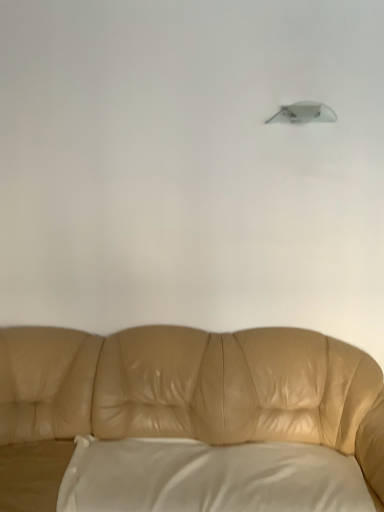
You are a GUI agent. You are given a task and a screenshot of the screen. Output one action in this format:
    pyautogui.click(x=<x>, y=<y>)
    Task: Click on the satin gray lampshade at upper center
    
    Given the screenshot: What is the action you would take?
    pyautogui.click(x=303, y=113)

The image size is (384, 512). What do you see at coordinates (210, 477) in the screenshot? I see `white satin pillow at lower center` at bounding box center [210, 477].

The image size is (384, 512). What are the coordinates of `satin gray lampshade at upper center` in the screenshot? It's located at click(303, 113).

Is white satin pillow at lower center situated inside tan leather couch at center or outside?

white satin pillow at lower center is contained in tan leather couch at center.

Between white satin pillow at lower center and tan leather couch at center, which one appears on the left side from the viewer's perspective?

tan leather couch at center.

Is the position of white satin pillow at lower center more distant than that of tan leather couch at center?

Yes, it is behind tan leather couch at center.

Does white satin pillow at lower center have a lesser width compared to satin gray lampshade at upper center?

No, white satin pillow at lower center is not thinner than satin gray lampshade at upper center.

Considering the relative sizes of white satin pillow at lower center and satin gray lampshade at upper center in the image provided, is white satin pillow at lower center smaller than satin gray lampshade at upper center?

Incorrect, white satin pillow at lower center is not smaller in size than satin gray lampshade at upper center.

Considering the sizes of white satin pillow at lower center and satin gray lampshade at upper center in the image, is white satin pillow at lower center taller or shorter than satin gray lampshade at upper center?

In the image, white satin pillow at lower center appears to be taller than satin gray lampshade at upper center.

From a real-world perspective, is white satin pillow at lower center physically below satin gray lampshade at upper center?

Yes, from a real-world perspective, white satin pillow at lower center is under satin gray lampshade at upper center.

Between tan leather couch at center and satin gray lampshade at upper center, which one has less height?

Standing shorter between the two is satin gray lampshade at upper center.

From a real-world perspective, is tan leather couch at center located higher than satin gray lampshade at upper center?

No, from a real-world perspective, tan leather couch at center is not on top of satin gray lampshade at upper center.

From the image's perspective, which is below, tan leather couch at center or satin gray lampshade at upper center?

tan leather couch at center appears lower in the image.

Which object is positioned more to the left, tan leather couch at center or white satin pillow at lower center?

tan leather couch at center.

From a real-world perspective, is tan leather couch at center positioned under white satin pillow at lower center based on gravity?

Actually, tan leather couch at center is physically above white satin pillow at lower center in the real world.

Are tan leather couch at center and white satin pillow at lower center making contact?

tan leather couch at center is not next to white satin pillow at lower center, and they're not touching.

Would you say white satin pillow at lower center is part of tan leather couch at center's contents?

Yes.

Where is `pillow located underneath the satin gray lampshade at upper center (from a real-world perspective)`? pillow located underneath the satin gray lampshade at upper center (from a real-world perspective) is located at coordinates click(x=210, y=477).

Is satin gray lampshade at upper center taller than white satin pillow at lower center?

In fact, satin gray lampshade at upper center may be shorter than white satin pillow at lower center.

Which object is closer to the camera, satin gray lampshade at upper center or white satin pillow at lower center?

white satin pillow at lower center.

Does satin gray lampshade at upper center touch white satin pillow at lower center?

No, satin gray lampshade at upper center is not beside white satin pillow at lower center.

From the picture: Can you tell me how much satin gray lampshade at upper center and tan leather couch at center differ in facing direction?

There is a 0.208-degree angle between the facing directions of satin gray lampshade at upper center and tan leather couch at center.

Which of these two, satin gray lampshade at upper center or tan leather couch at center, is smaller?

satin gray lampshade at upper center is smaller.

Which point is more distant from viewer, (331, 116) or (359, 454)?

Positioned behind is point (331, 116).

Which object is thinner, satin gray lampshade at upper center or tan leather couch at center?

With smaller width is satin gray lampshade at upper center.

Locate an element on the screen. This screenshot has width=384, height=512. pillow below the tan leather couch at center (from the image's perspective) is located at coordinates (210, 477).

Where is `lamp above the white satin pillow at lower center (from the image's perspective)`? The image size is (384, 512). lamp above the white satin pillow at lower center (from the image's perspective) is located at coordinates (303, 113).

Which object lies further to the anchor point tan leather couch at center, satin gray lampshade at upper center or white satin pillow at lower center?

satin gray lampshade at upper center.

Consider the image. Estimate the real-world distances between objects in this image. Which object is further from tan leather couch at center, white satin pillow at lower center or satin gray lampshade at upper center?

The object further to tan leather couch at center is satin gray lampshade at upper center.

When comparing their distances from white satin pillow at lower center, does satin gray lampshade at upper center or tan leather couch at center seem closer?

Based on the image, tan leather couch at center appears to be nearer to white satin pillow at lower center.

Looking at the image, which one is located further to white satin pillow at lower center, tan leather couch at center or satin gray lampshade at upper center?

satin gray lampshade at upper center.

Which object lies nearer to the anchor point satin gray lampshade at upper center, tan leather couch at center or white satin pillow at lower center?

tan leather couch at center lies closer to satin gray lampshade at upper center than the other object.

Estimate the real-world distances between objects in this image. Which object is further from satin gray lampshade at upper center, white satin pillow at lower center or tan leather couch at center?

white satin pillow at lower center is positioned further to the anchor satin gray lampshade at upper center.

I want to click on studio couch between satin gray lampshade at upper center and white satin pillow at lower center in the vertical direction, so click(x=183, y=394).